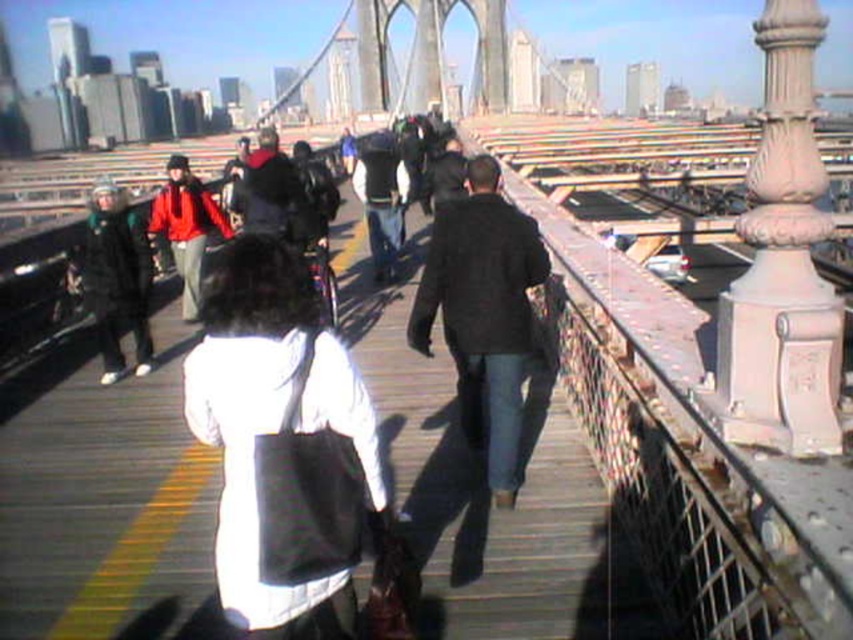
You are standing on the wooden bridge at center and want to greet the person wearing the black matte jacket at center. In which direction should you walk to approach them?

The wooden bridge at center is positioned on the left side of the black matte jacket at center, so you should walk to the right to approach them.

You are a photographer standing on the Brooklyn Bridge and want to take a photo of the white matte bag at center and the black matte jacket at center. Which object should you adjust your camera focus to first if you want to capture both clearly in the same frame?

The white matte bag at center is positioned on the left side of black matte jacket at center. Since both objects are at the same center position, you can focus on either one first as they are at the same distance from the camera.

In the scene shown: You are standing on the Brooklyn Bridge and see two people wearing jackets. One has a black matte jacket at center and the other has a matte red jacket at center. From your perspective, which jacket is positioned to the right?

The black matte jacket at center is positioned to the right of the matte red jacket at center.